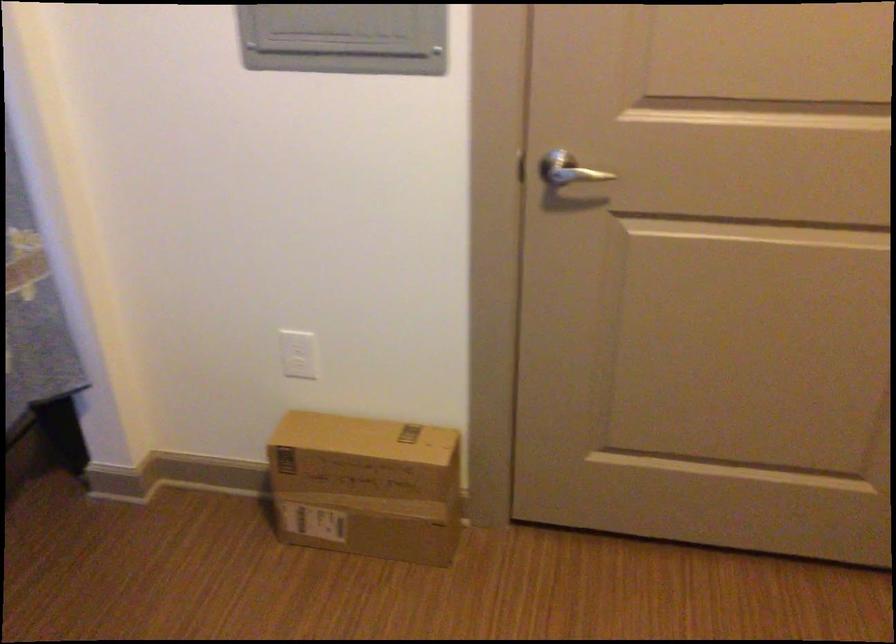
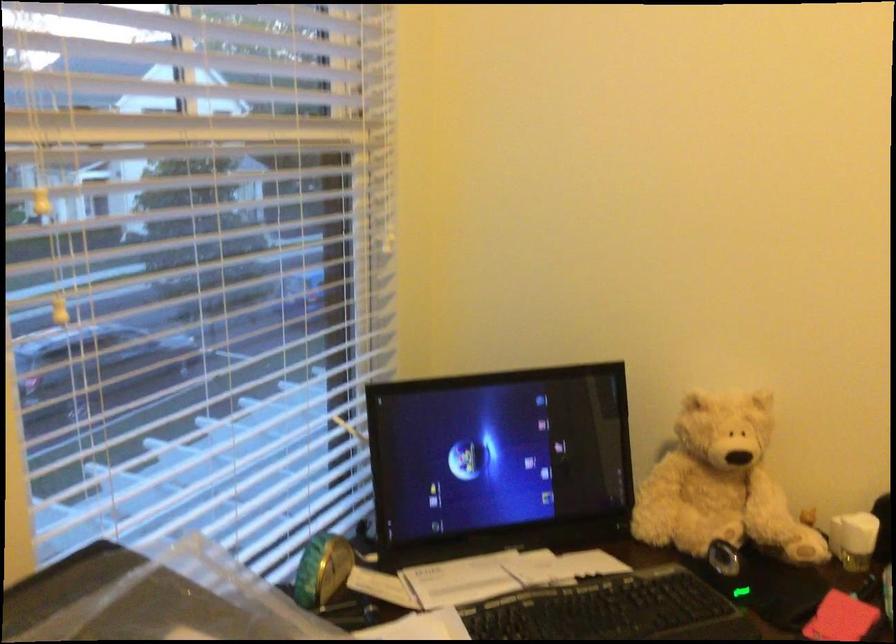
The images are taken continuously from a first-person perspective. In which direction is your viewpoint rotating?

The camera rotated toward left-down.